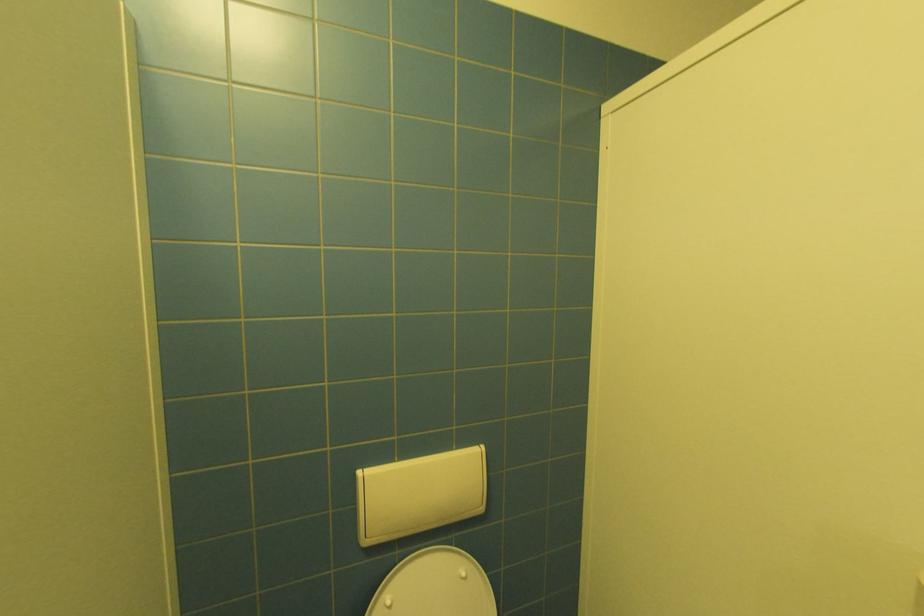
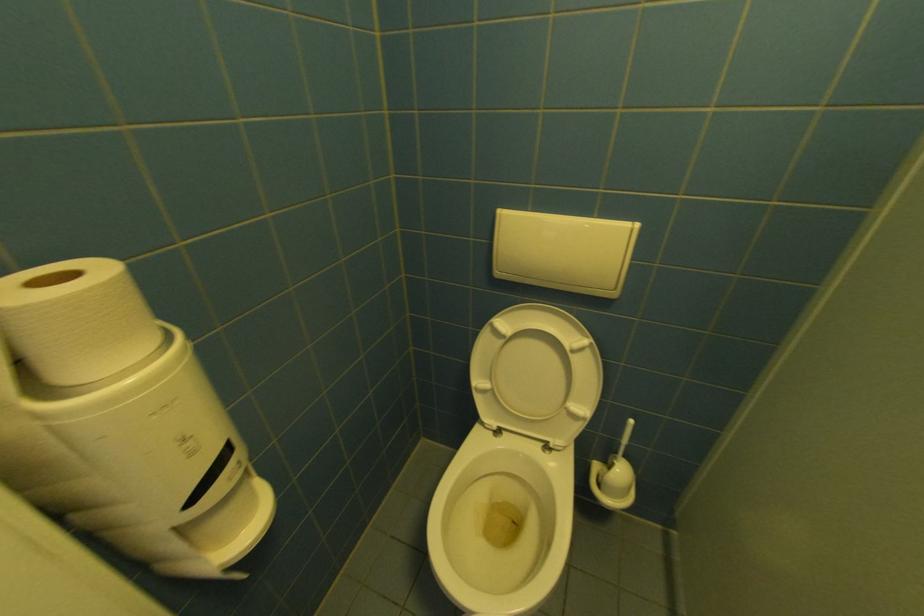
Based on the continuous images, in which direction is the camera rotating?

The camera's rotation is toward left-down.